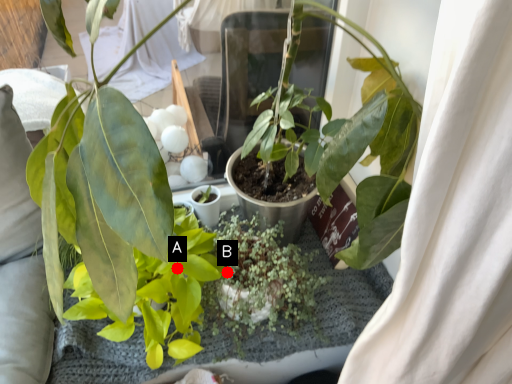
Question: Two points are circled on the image, labeled by A and B beside each circle. Which point is further to the camera?

Choices:
 (A) A is further
 (B) B is further

Answer: (B)